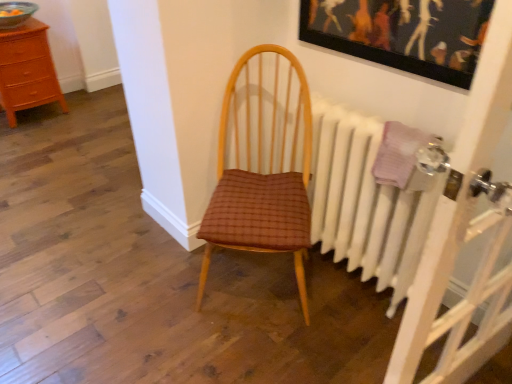
At what (x,y) coordinates should I click in order to perform the action: click on free space below white painted radiator at right (from a real-world perspective). Please return your answer as a coordinate pair (x, y). This screenshot has width=512, height=384. Looking at the image, I should click on pyautogui.click(x=353, y=284).